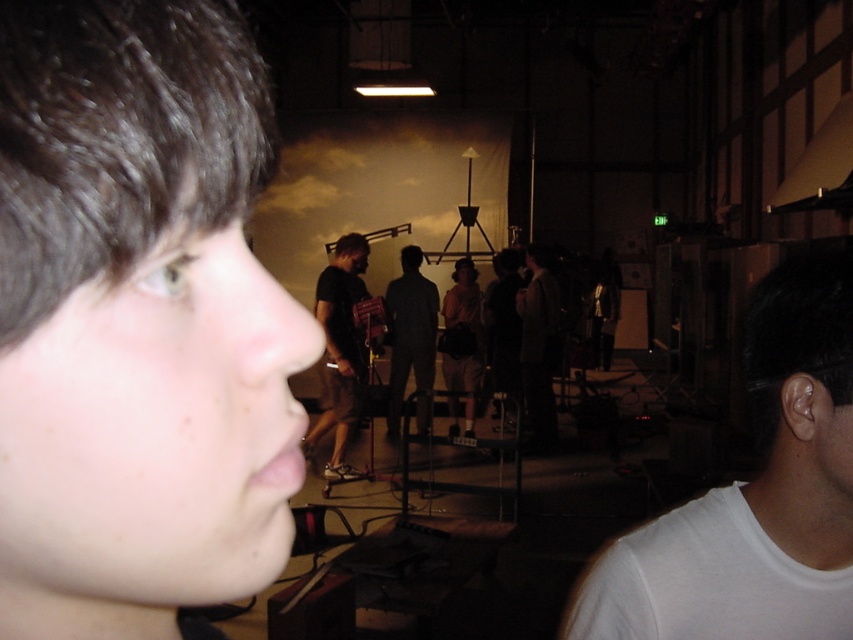
The width and height of the screenshot is (853, 640). Find the location of `smooth skin face at left`. smooth skin face at left is located at coordinates (137, 321).

Is the position of black matte shorts at center less distant than that of dark gray suit at center?

Yes, it is in front of dark gray suit at center.

Does point (337, 417) lie in front of point (549, 356)?

That is True.

Does point (345, 378) come in front of point (531, 419)?

Yes, point (345, 378) is closer to viewer.

Find the location of `black matte shorts at center`. black matte shorts at center is located at coordinates (339, 349).

Can you confirm if white matte t-shirt at right is taller than dark gray pants at center?

No, white matte t-shirt at right is not taller than dark gray pants at center.

What do you see at coordinates (755, 493) in the screenshot?
I see `white matte t-shirt at right` at bounding box center [755, 493].

The width and height of the screenshot is (853, 640). I want to click on white matte t-shirt at right, so (755, 493).